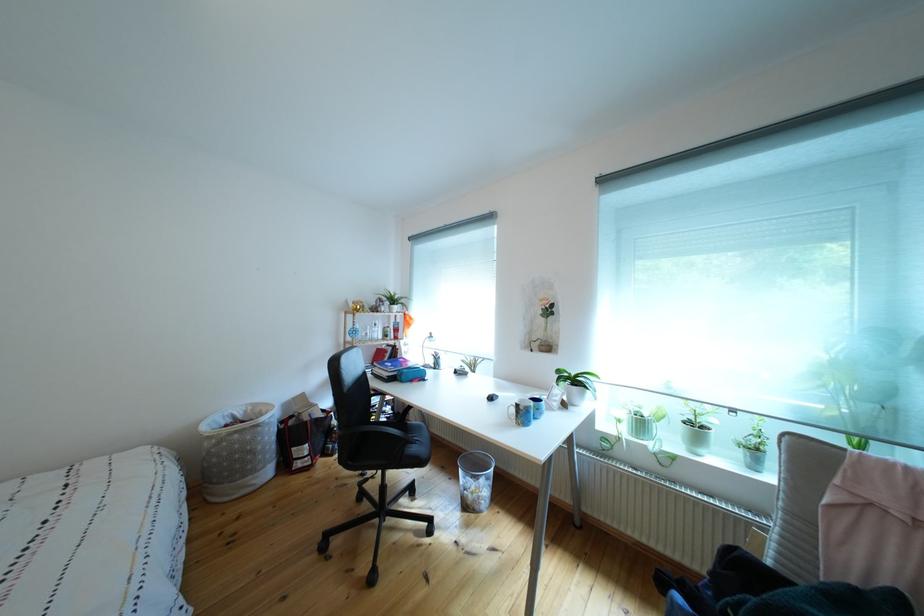
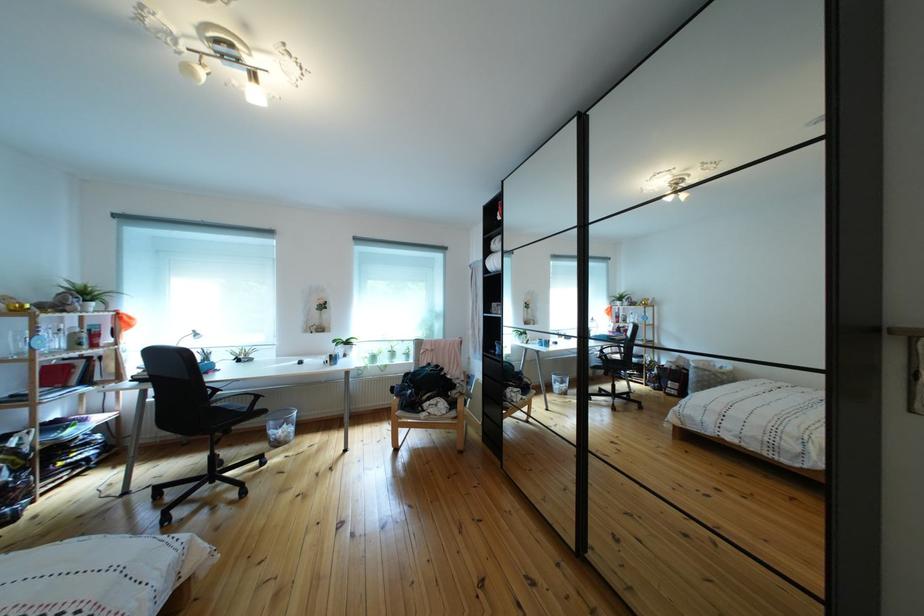
Question: I am providing you with two images of the same scene from different viewpoints. Which of the following objects are not visible in image2?

Choices:
 (A) chair sitting surface
 (B) white spray bottle
 (C) blue cream jar
 (D) wire mesh trashcan

Answer: (B)